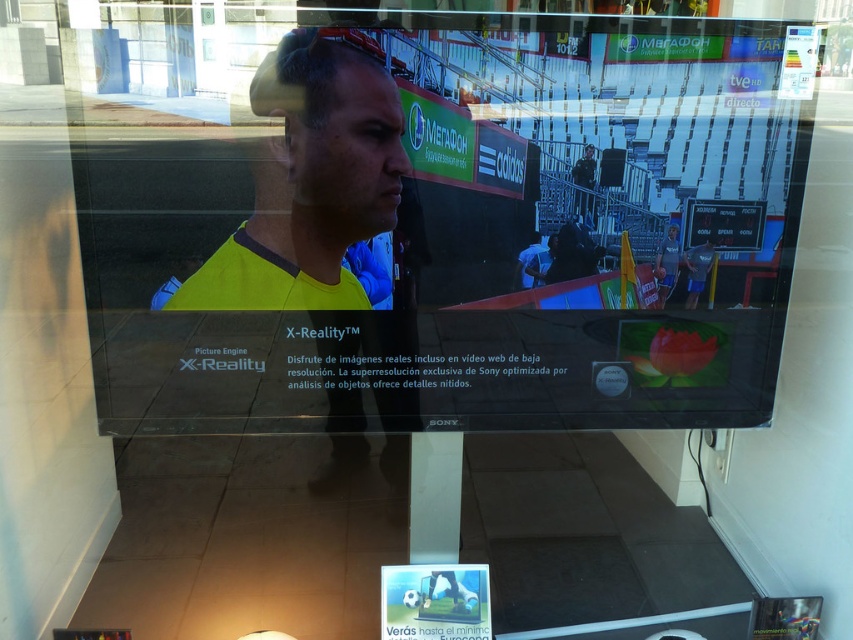
Does matte black tv at center have a larger size compared to yellow matte shirt at center?

Indeed, matte black tv at center has a larger size compared to yellow matte shirt at center.

Who is shorter, matte black tv at center or yellow matte shirt at center?

yellow matte shirt at center

Locate an element on the screen. This screenshot has width=853, height=640. matte black tv at center is located at coordinates (457, 234).

The width and height of the screenshot is (853, 640). I want to click on matte black tv at center, so click(457, 234).